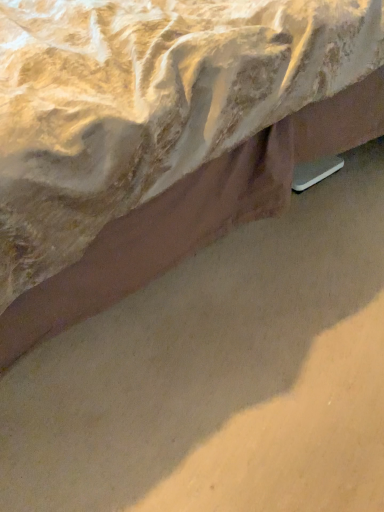
The image size is (384, 512). I want to click on brown fabric bed at lower right, so click(161, 136).

What do you see at coordinates (161, 136) in the screenshot? I see `brown fabric bed at lower right` at bounding box center [161, 136].

This screenshot has height=512, width=384. In order to click on brown fabric bed at lower right in this screenshot , I will do `click(161, 136)`.